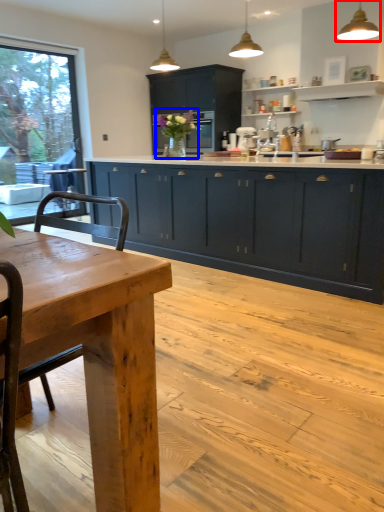
Question: Which of the following is the farthest to the observer, light fixture (highlighted by a red box) or floral arrangement (highlighted by a blue box)?

Choices:
 (A) light fixture
 (B) floral arrangement

Answer: (B)